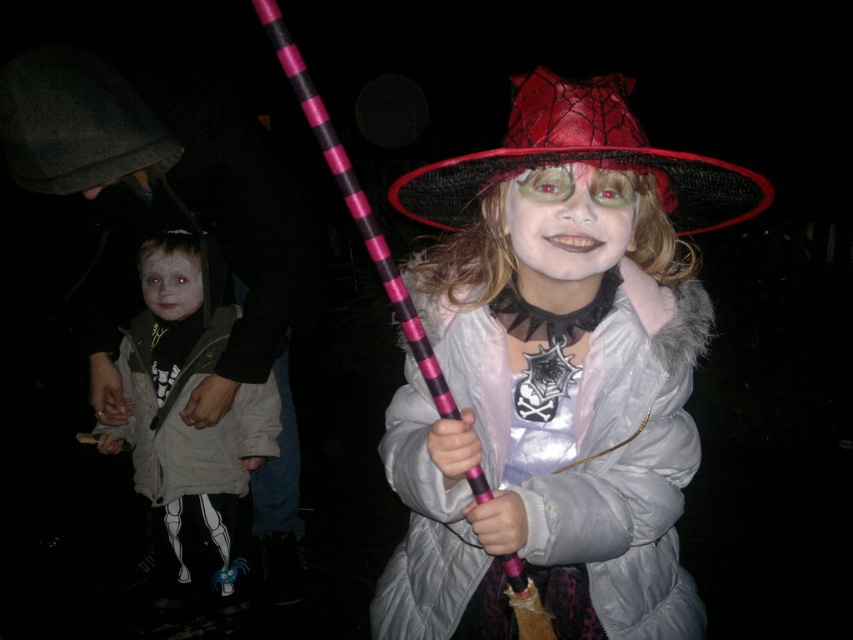
Question: Is white skeleton-patterned pants at lower left above matte black face at center?

Choices:
 (A) yes
 (B) no

Answer: (B)

Question: Which object appears farthest from the camera in this image?

Choices:
 (A) red mesh witch hat at center
 (B) pale skin at center
 (C) matte pink wand at center
 (D) matte black face at center

Answer: (B)

Question: In this image, where is matte pink wand at center located relative to matte black face at center?

Choices:
 (A) left
 (B) right

Answer: (B)

Question: Which object appears farthest from the camera in this image?

Choices:
 (A) pale skin at center
 (B) matte pink wand at center
 (C) matte black face at center
 (D) red mesh witch hat at center

Answer: (A)

Question: Can you confirm if matte pink wand at center is wider than white skeleton-patterned pants at lower left?

Choices:
 (A) yes
 (B) no

Answer: (A)

Question: Which object appears closest to the camera in this image?

Choices:
 (A) matte pink wand at center
 (B) pale skin at center
 (C) matte black face at center
 (D) white skeleton-patterned pants at lower left

Answer: (A)